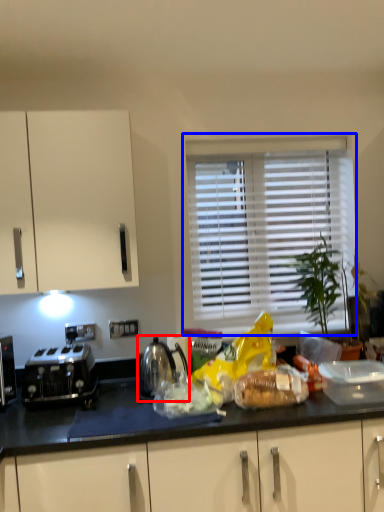
Question: Which object is closer to the camera taking this photo, kettle (highlighted by a red box) or window (highlighted by a blue box)?

Choices:
 (A) kettle
 (B) window

Answer: (A)